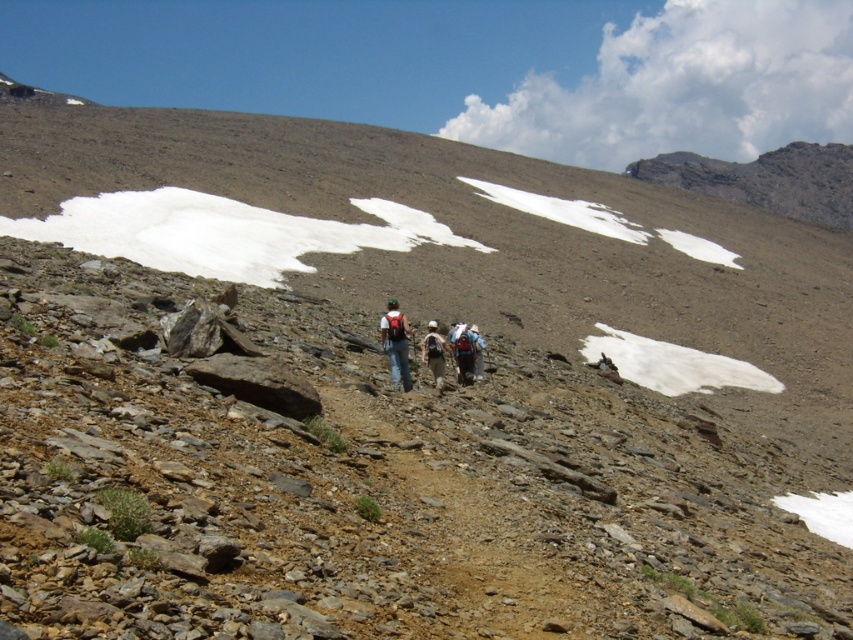
Between blue fabric backpack at center and matte gray backpack at center, which one is positioned lower?

blue fabric backpack at center is lower down.

Between point (466, 380) and point (474, 372), which one is positioned behind?

Positioned behind is point (474, 372).

Find the location of a particular element. blue fabric backpack at center is located at coordinates (463, 353).

Does matte blue jeans at center have a larger size compared to matte white backpack at center?

Correct, matte blue jeans at center is larger in size than matte white backpack at center.

Is point (392, 371) positioned in front of point (434, 372)?

Yes.

Describe the element at coordinates (396, 344) in the screenshot. The image size is (853, 640). I see `matte blue jeans at center` at that location.

Locate an element on the screen. Image resolution: width=853 pixels, height=640 pixels. matte blue jeans at center is located at coordinates (396, 344).

Between matte blue jeans at center and matte gray backpack at center, which one has more height?

matte blue jeans at center is taller.

Is point (393, 348) closer to camera compared to point (479, 355)?

Yes, point (393, 348) is closer to viewer.

The image size is (853, 640). I want to click on matte blue jeans at center, so click(x=396, y=344).